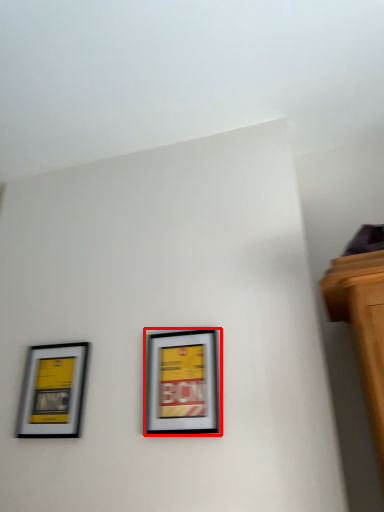
Question: From the image's perspective, where is picture frame (annotated by the red box) located in relation to picture frame in the image?

Choices:
 (A) above
 (B) below

Answer: (A)